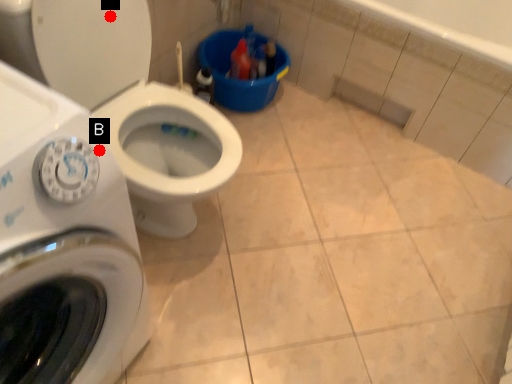
Question: Two points are circled on the image, labeled by A and B beside each circle. Which of the following is the farthest from the observer?

Choices:
 (A) A is further
 (B) B is further

Answer: (A)